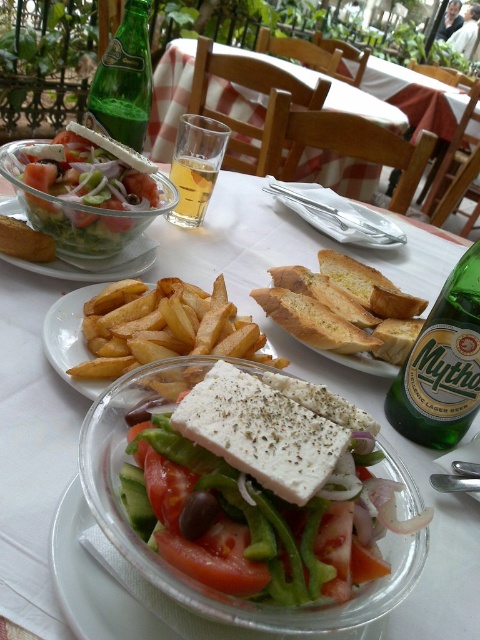
At what (x,y) coordinates should I click in order to perform the action: click on golden crispy fries at center. Please return your answer as a coordinate pair (x, y). Looking at the image, I should click on (71, 339).

Who is more distant from viewer, (79, 323) or (135, 241)?

The point (135, 241) is behind.

This screenshot has height=640, width=480. I want to click on golden crispy fries at center, so click(71, 339).

Who is more distant from viewer, [231,490] or [254,580]?

The point [231,490] is more distant.

This screenshot has height=640, width=480. In order to click on white creamy feta cheese at center in this screenshot , I will do `click(259, 490)`.

Locate an element on the screen. The image size is (480, 640). white creamy feta cheese at center is located at coordinates (259, 490).

Can you confirm if fresh green salad at upper left is taller than clear glass bowl at center?

Indeed, fresh green salad at upper left has a greater height compared to clear glass bowl at center.

Which of these two, fresh green salad at upper left or clear glass bowl at center, stands shorter?

Standing shorter between the two is clear glass bowl at center.

Is point (98, 252) more distant than point (120, 266)?

No, it is in front of (120, 266).

Where is `fresh green salad at upper left`? The height and width of the screenshot is (640, 480). fresh green salad at upper left is located at coordinates (81, 212).